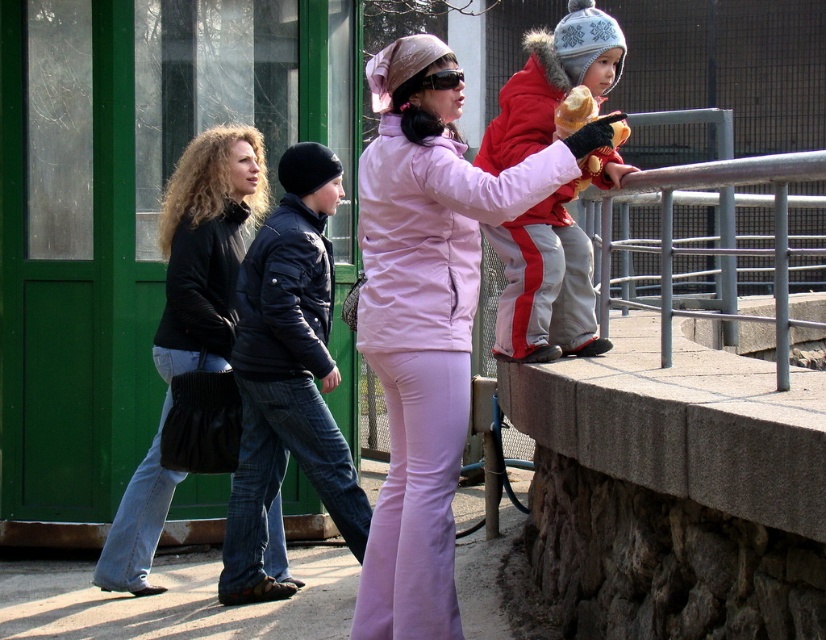
You are a photographer trying to capture a candid shot of the two jackets in the scene. Which jacket, the pink matte jacket at center or the black quilted jacket at center, is more visible to you from your current position?

The pink matte jacket at center is more visible because it is positioned over the black quilted jacket at center, making it closer to the photographer.

You are a photographer trying to capture a candid shot of the pink matte jacket at center and the matte black jacket at left. Since you want to focus on their positions, can you tell me which of the two jackets is higher up in the image?

The pink matte jacket at center is located above the matte black jacket at left, so it is higher up in the image.